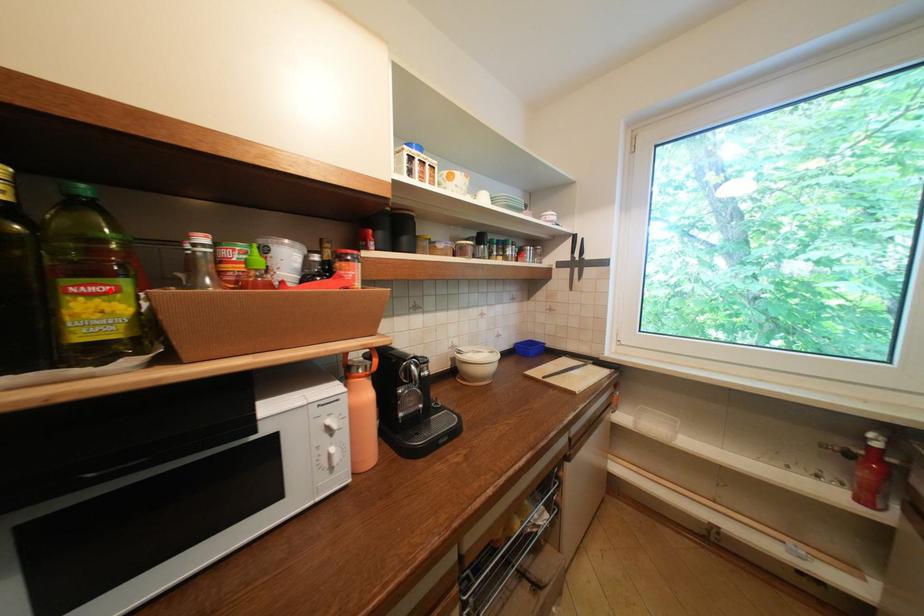
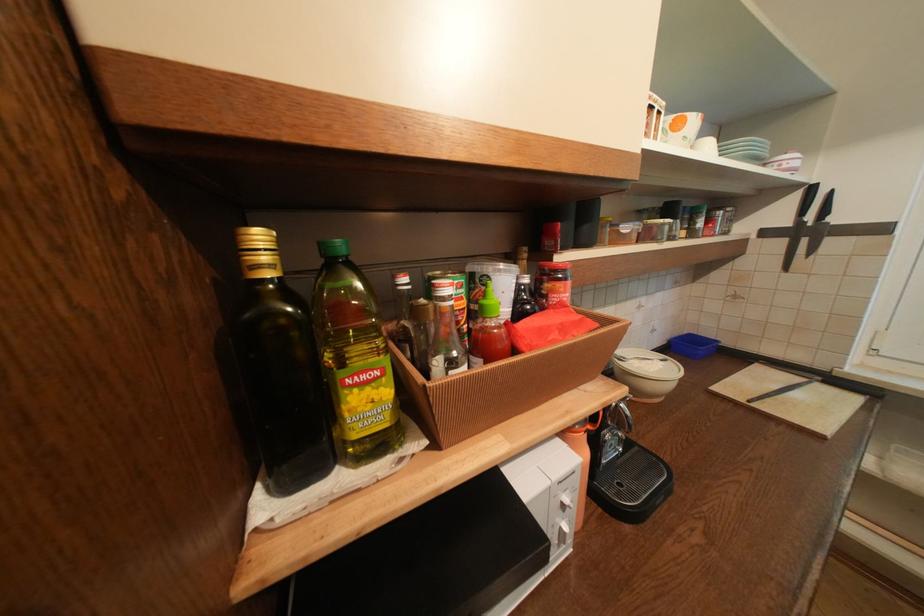
Where in the second image is the point corresponding to the highlighted location from the first image?

(379, 377)